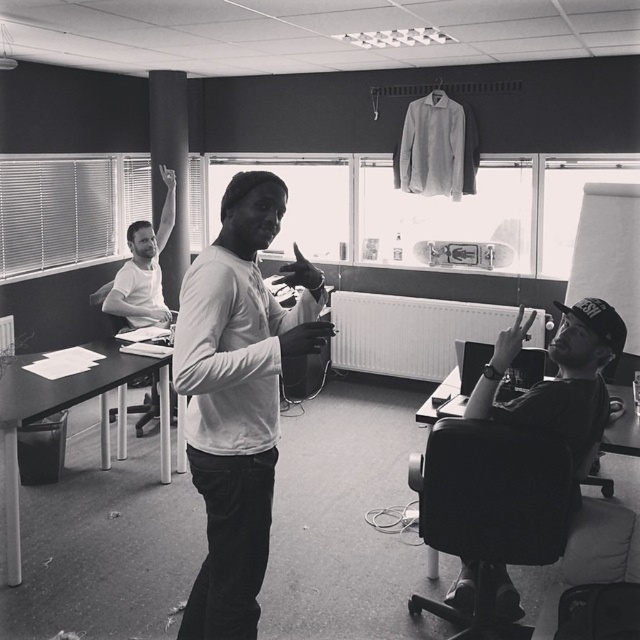
Which is more to the left, black leather swivel chair at lower right or smooth black cap at right?

black leather swivel chair at lower right

Does point (412, 467) come farther from viewer compared to point (579, 376)?

Yes, it is.

Locate an element on the screen. The width and height of the screenshot is (640, 640). black leather swivel chair at lower right is located at coordinates (490, 509).

Which is behind, point (461, 566) or point (150, 321)?

Positioned behind is point (150, 321).

The image size is (640, 640). Identify the location of smooth black cap at right. (563, 385).

Does white matte long-sleeve shirt at center appear over smooth black cap at right?

No, white matte long-sleeve shirt at center is not above smooth black cap at right.

Does white matte long-sleeve shirt at center come behind smooth black cap at right?

No, white matte long-sleeve shirt at center is closer to the viewer.

The height and width of the screenshot is (640, 640). What are the coordinates of `white matte long-sleeve shirt at center` in the screenshot? It's located at click(236, 397).